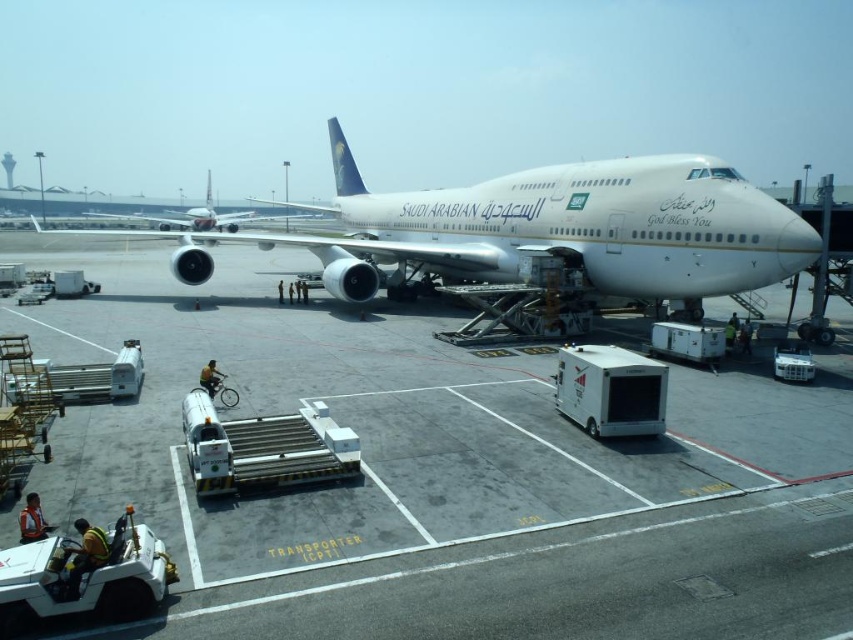
You are a maintenance worker needing to park a 10 meter wide equipment truck between the white glossy tarmac at center and the white metallic airplane at center. Can you fit the truck there?

The white glossy tarmac at center has a lesser width compared to the white metallic airplane at center, so the truck cannot fit between them since the available space is narrower than the truck.

You are a ground crew member standing at point (427, 211). You need to reach point (503, 426) to inspect the aircraft. Which direction should you move relative to the jet bridge?

You should move forward relative to the jet bridge because point (503, 426) is in front of point (427, 211).